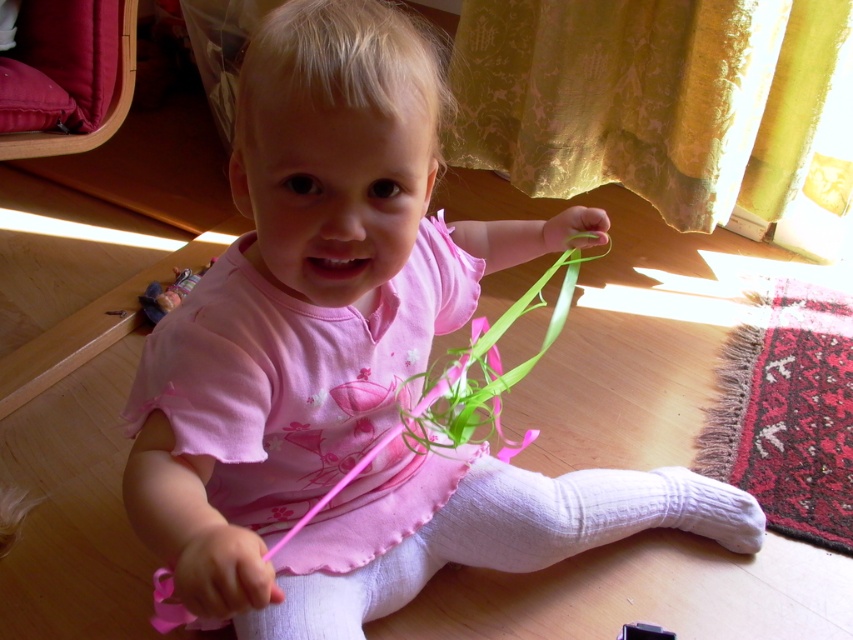
You are holding a measuring tape and need to determine if a 36 inch long ribbon can reach from your current position to the point at coordinates point (467, 394). Can the ribbon reach that point?

The distance between the viewer and point (467, 394) is 38.01 inches, which is longer than the 36 inch ribbon. Therefore, the ribbon cannot reach the point.

The child is playing with both the green silky ribbon at center and the striped fabric doll at left. Which object is closer to the child?

The green silky ribbon at center is closer to the child because it is in front of the striped fabric doll at left.